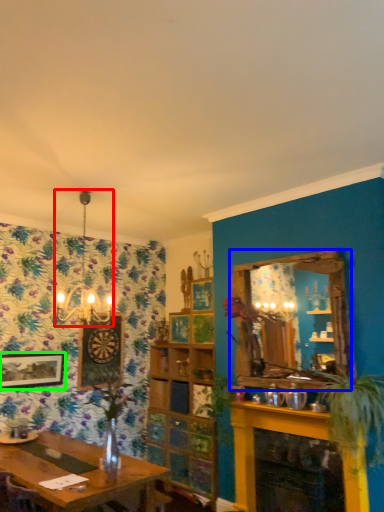
Question: Which is farther away from light fixture (highlighted by a red box)? window (highlighted by a blue box) or picture frame (highlighted by a green box)?

Choices:
 (A) window
 (B) picture frame

Answer: (A)